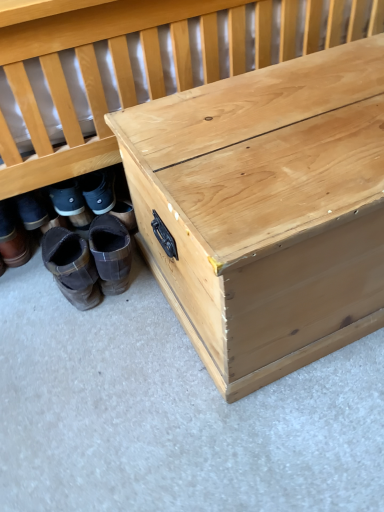
Where is `vacant space situated above brown suede boots at lower left, the 2th footwear viewed from the right (from a real-world perspective)`? This screenshot has height=512, width=384. vacant space situated above brown suede boots at lower left, the 2th footwear viewed from the right (from a real-world perspective) is located at coordinates (69, 257).